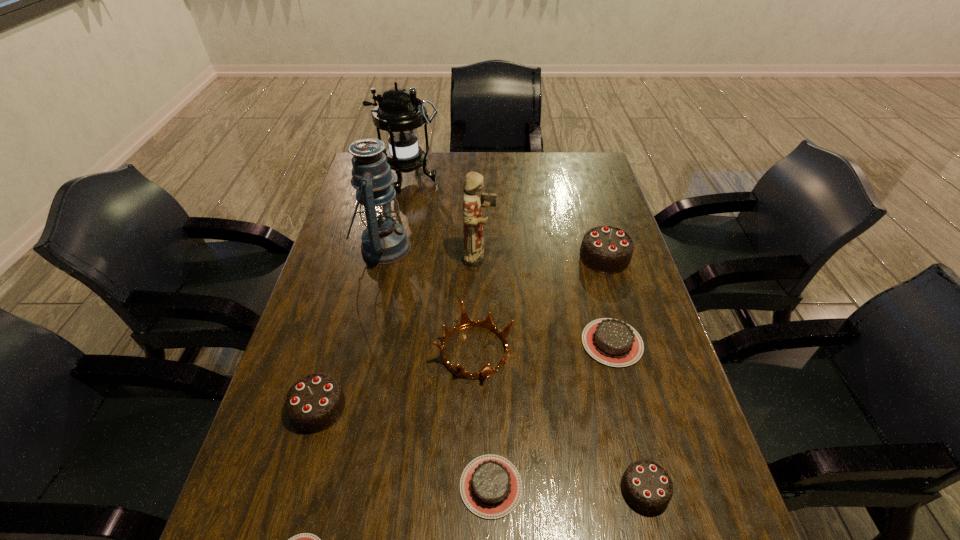
Find the location of a particular element. The image size is (960, 540). black lantern is located at coordinates (399, 113).

What are the coordinates of `the farthest object` in the screenshot? It's located at (399, 113).

Locate an element on the screen. the nearer lantern is located at coordinates (384, 241).

The image size is (960, 540). I want to click on figurine, so click(473, 221).

Locate an element on the screen. The height and width of the screenshot is (540, 960). the biggest chocolate chocolate cake is located at coordinates (605, 249).

Locate an element on the screen. Image resolution: width=960 pixels, height=540 pixels. the tallest chocolate cake is located at coordinates (605, 249).

The height and width of the screenshot is (540, 960). What are the coordinates of `the second farthest chocolate chocolate cake` in the screenshot? It's located at (315, 402).

This screenshot has height=540, width=960. In order to click on the fourth nearest chocolate cake in this screenshot , I will do `click(315, 402)`.

At what (x,y) coordinates should I click in order to perform the action: click on gold crown. Please return your answer as a coordinate pair (x, y). Looking at the image, I should click on (465, 322).

What are the coordinates of `the nearest chocolate chocolate cake` in the screenshot? It's located at (646, 485).